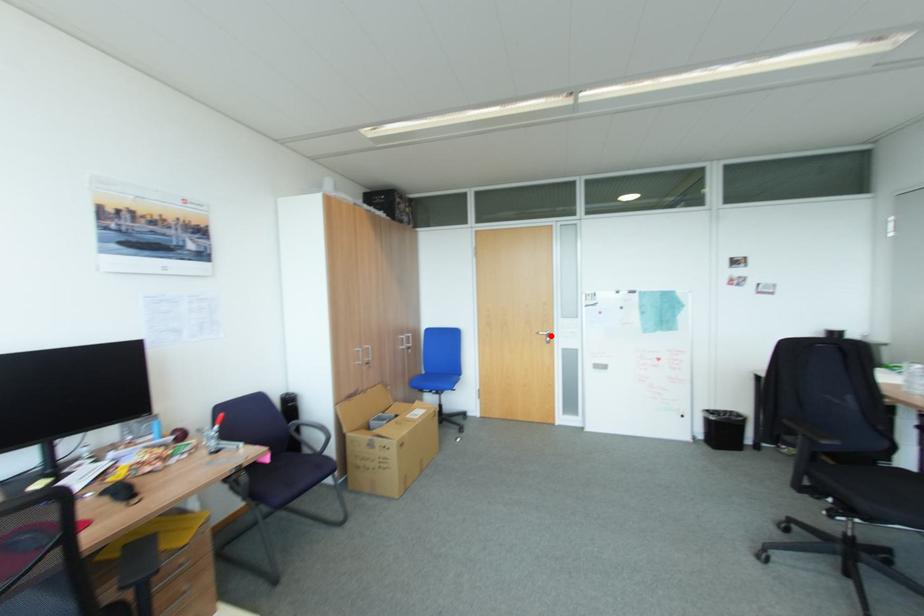
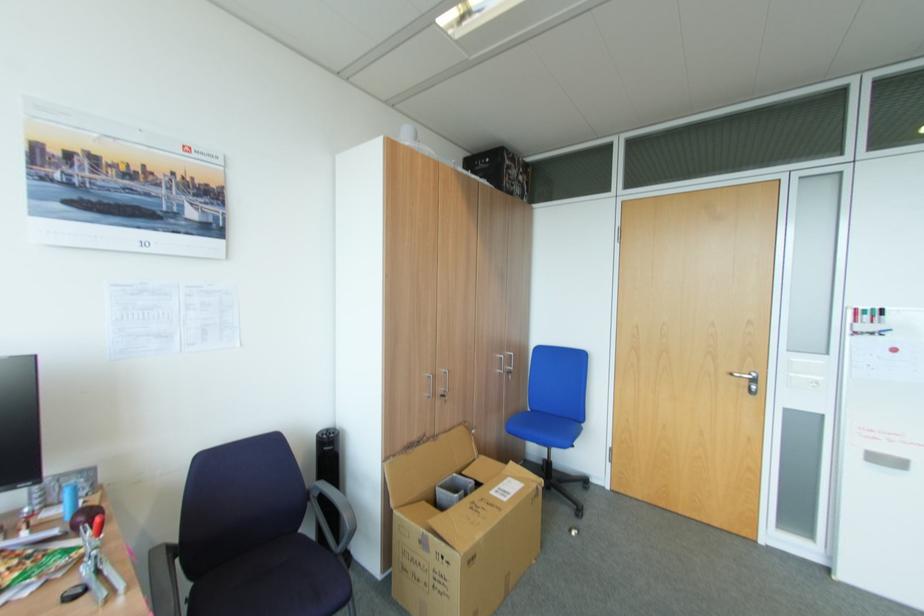
Locate, in the second image, the point that corresponds to the highlighted location in the first image.

(751, 381)